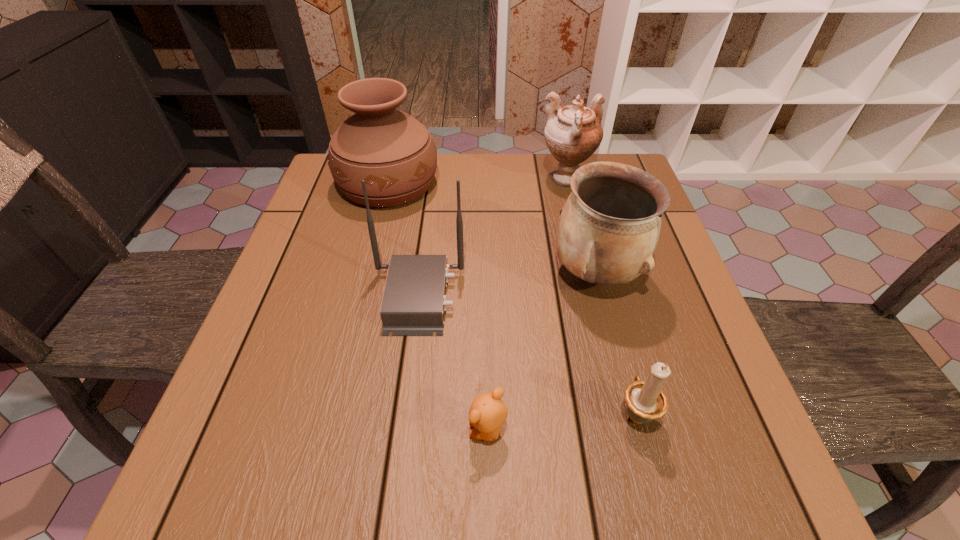
The image size is (960, 540). I want to click on free spot between the fourth object from right to left and the second shortest object, so click(x=562, y=422).

The image size is (960, 540). Identify the location of vacant area between the fifth tallest object and the nearest urn. 616,343.

You are a GUI agent. You are given a task and a screenshot of the screen. Output one action in this format:
    pyautogui.click(x=<x>, y=<y>)
    Task: Click on the unoccupied area between the leftmost urn and the router
    Image resolution: width=960 pixels, height=540 pixels.
    Given the screenshot: What is the action you would take?
    pyautogui.click(x=403, y=241)

Identify the location of object that can be found as the third closest to the router. (609, 227).

Point out which object is positioned as the third nearest to the leftmost urn. Please provide its 2D coordinates. Your answer should be formatted as a tuple, i.e. [(x, y)], where the tuple contains the x and y coordinates of a point satisfying the conditions above.

[(609, 227)]

Locate an element on the screen. The width and height of the screenshot is (960, 540). urn that is the third closest to the fifth tallest object is located at coordinates (394, 153).

Where is `urn object that ranks as the second closest to the nearest urn`? This screenshot has width=960, height=540. urn object that ranks as the second closest to the nearest urn is located at coordinates (394, 153).

Locate an element on the screen. free space that satisfies the following two spatial constraints: 1. on the back of the router to connect cables; 2. on the handle side of the second shortest object is located at coordinates (402, 413).

This screenshot has width=960, height=540. Find the location of `vacant region that satisfies the following two spatial constraints: 1. on the handle side of the second shortest object; 2. on the back of the router to connect cables`. vacant region that satisfies the following two spatial constraints: 1. on the handle side of the second shortest object; 2. on the back of the router to connect cables is located at coordinates (606, 297).

The height and width of the screenshot is (540, 960). Identify the location of free spot that satisfies the following two spatial constraints: 1. on the handle side of the second shortest object; 2. on the back of the router to connect cables. (606, 297).